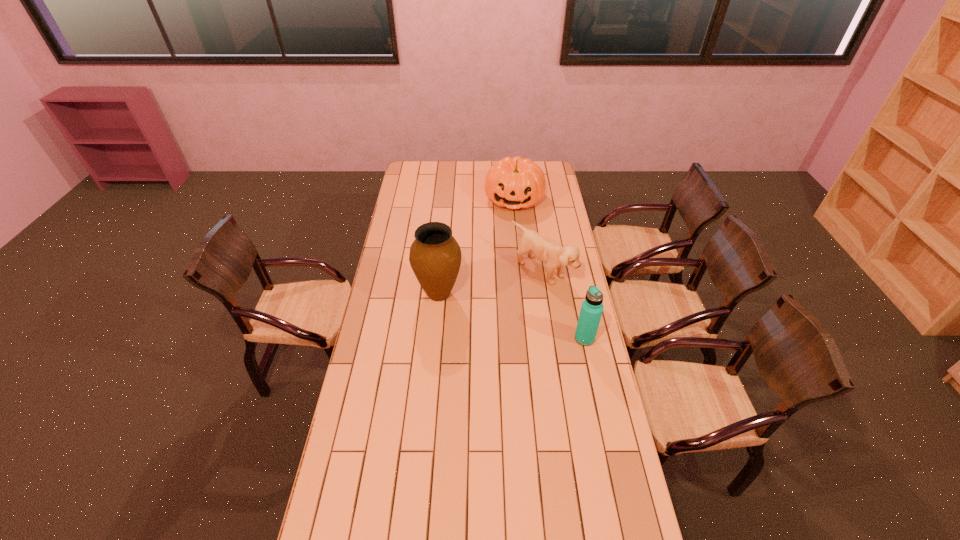
You are a GUI agent. You are given a task and a screenshot of the screen. Output one action in this format:
    pyautogui.click(x=<x>, y=<y>)
    Task: Click on the vacant space situated on the carved face of the farthest object
    This screenshot has width=960, height=540.
    Given the screenshot: What is the action you would take?
    pyautogui.click(x=511, y=231)

This screenshot has width=960, height=540. I want to click on free space located 0.190m on the carved face of the farthest object, so click(x=510, y=238).

At what (x,y) coordinates should I click in order to perform the action: click on vacant space located on the carved face of the farthest object. Please return your answer as a coordinate pair (x, y). The width and height of the screenshot is (960, 540). Looking at the image, I should click on (507, 260).

Identify the location of water bottle that is at the right edge. (592, 307).

What are the coordinates of `puppy that is at the right edge` in the screenshot? It's located at (555, 256).

The image size is (960, 540). I want to click on pumpkin at the right edge, so pyautogui.click(x=514, y=183).

Identify the location of vacant space at the far edge. (466, 169).

In the image, there is a desktop. Where is `vacant space at the near edge`? vacant space at the near edge is located at coordinates (385, 515).

This screenshot has width=960, height=540. In order to click on free space at the left edge of the desktop in this screenshot , I will do `click(394, 363)`.

At what (x,y) coordinates should I click in order to perform the action: click on vacant area at the right edge. Please return your answer as a coordinate pair (x, y). The image size is (960, 540). Looking at the image, I should click on point(564,380).